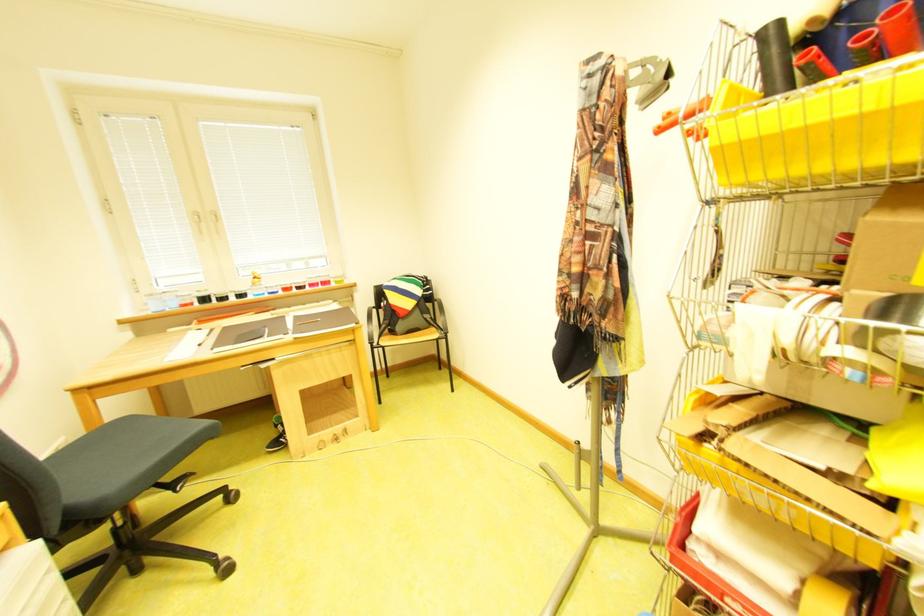
Describe the element at coordinates (774, 58) in the screenshot. This screenshot has width=924, height=616. I see `a black roll` at that location.